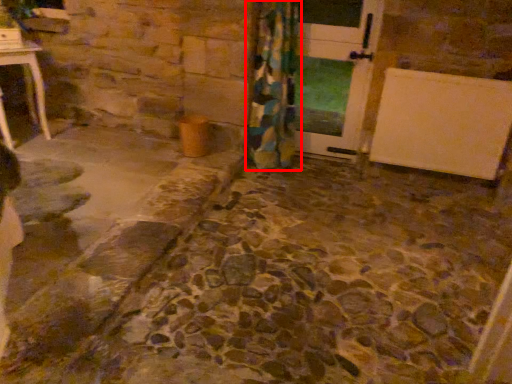
Question: Where is curtain (annotated by the red box) located in relation to door in the image?

Choices:
 (A) right
 (B) left

Answer: (B)